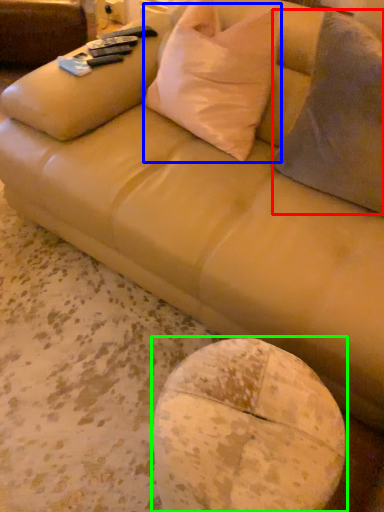
Question: Considering the real-world distances, which object is closest to throw pillow (highlighted by a red box)? throw pillow (highlighted by a blue box) or round table (highlighted by a green box).

Choices:
 (A) throw pillow
 (B) round table

Answer: (A)